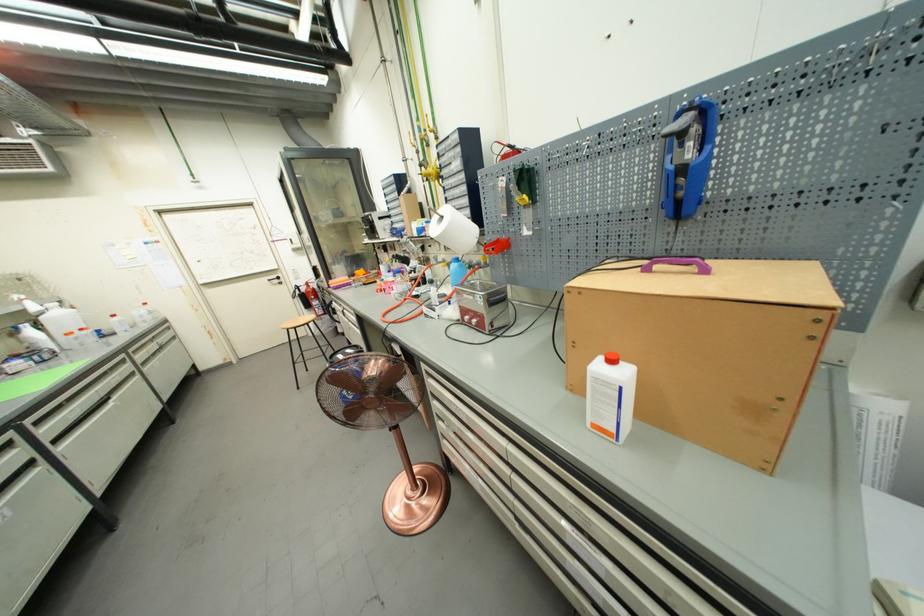
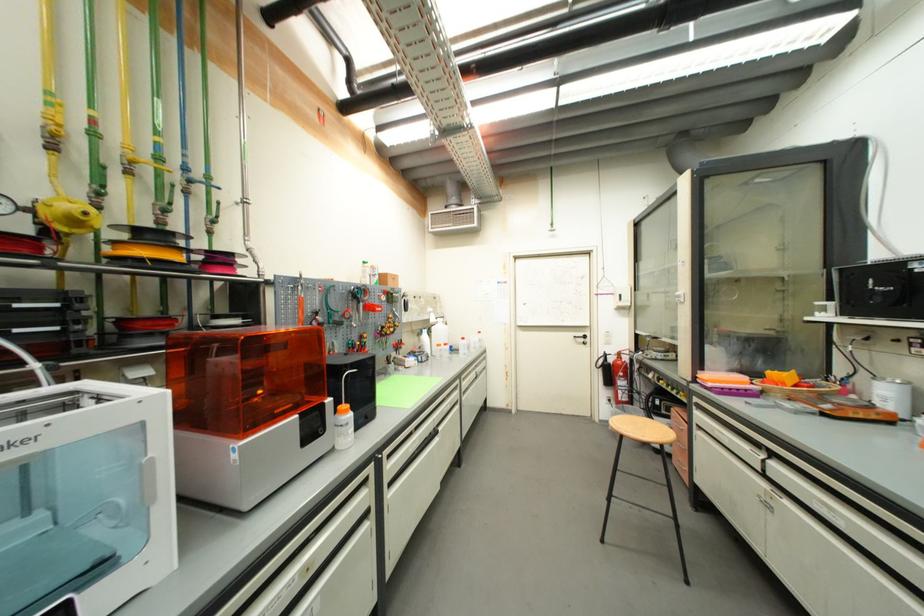
Where in the second image is the point corresponding to point 274,282 from the first image?

(580, 339)